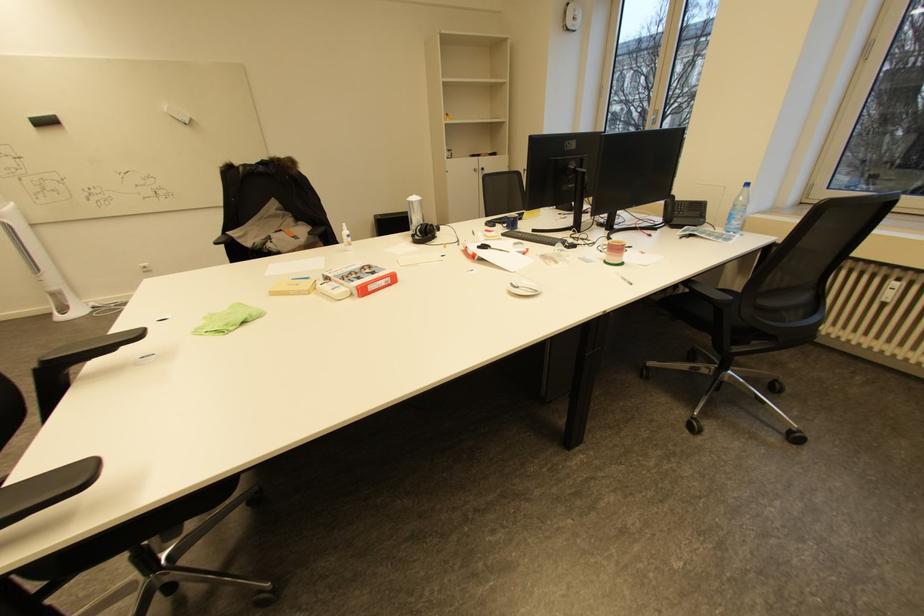
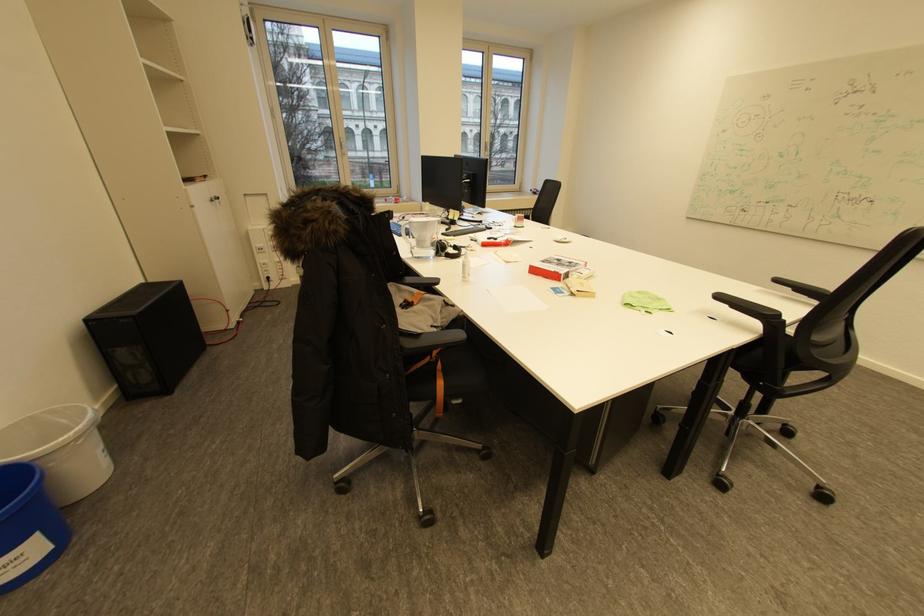
Where in the second image is the point corresponding to [363,278] from the first image?

(576, 262)